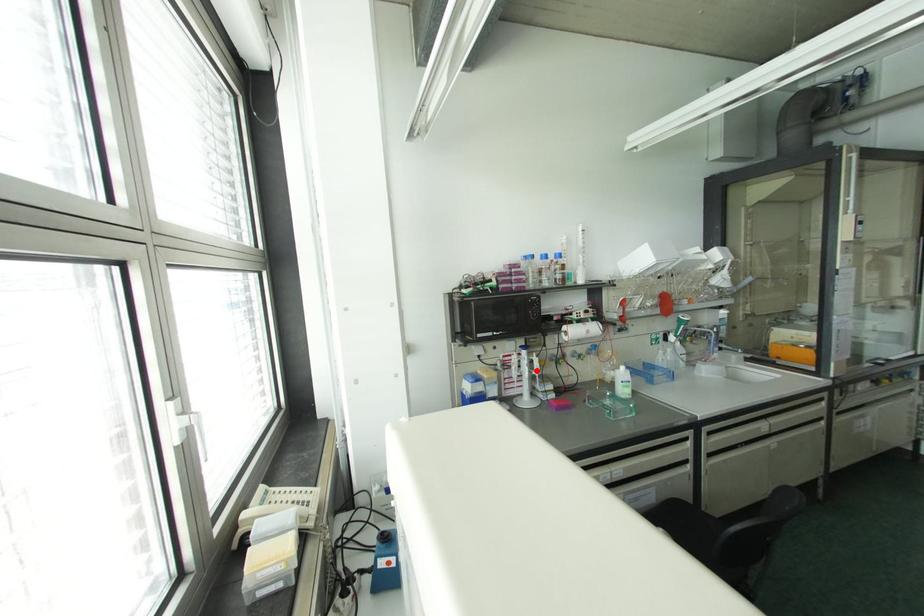
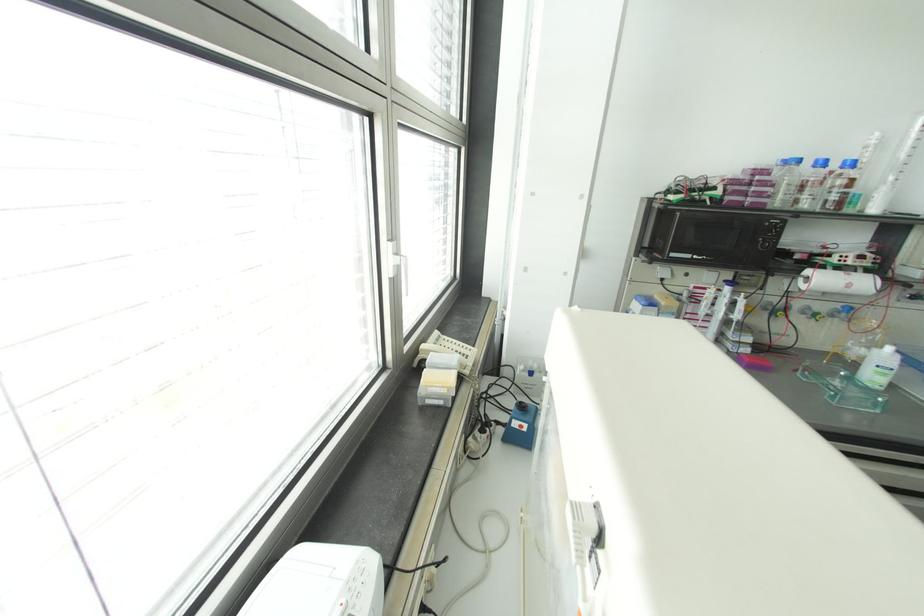
In the second image, find the point that corresponds to the highlighted location in the first image.

(736, 315)